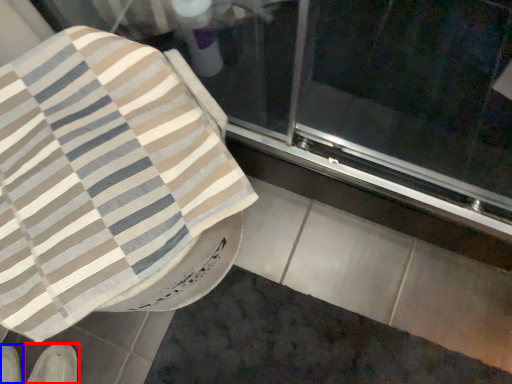
Question: Which of the following is the farthest to the observer, footwear (highlighted by a red box) or footwear (highlighted by a blue box)?

Choices:
 (A) footwear
 (B) footwear

Answer: (B)